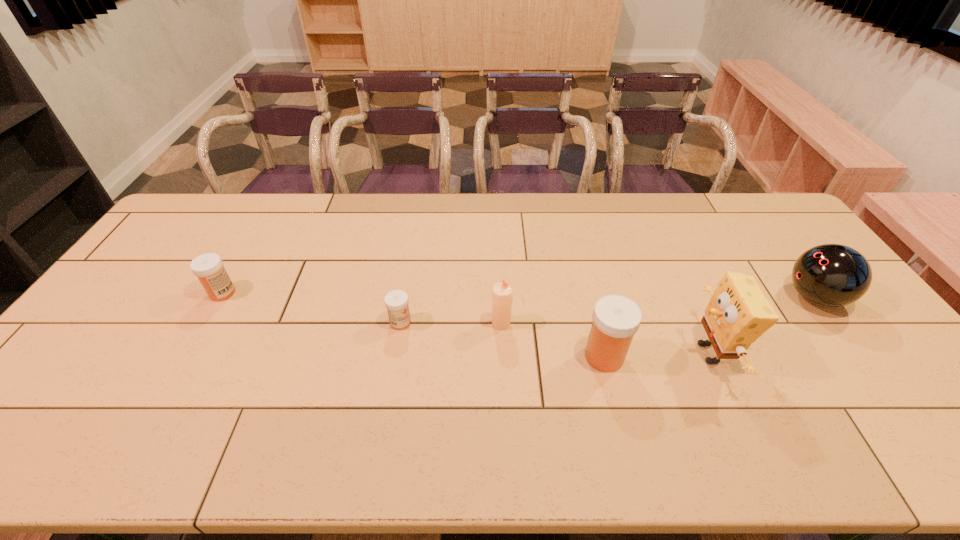
Where is `vacant space located on the right of the farthest medicine`? The image size is (960, 540). vacant space located on the right of the farthest medicine is located at coordinates (337, 293).

Locate an element on the screen. This screenshot has width=960, height=540. blank area located on the back of the second object from left to right is located at coordinates (414, 246).

Where is `vacant region located on the back of the fourth object from left to right`? The width and height of the screenshot is (960, 540). vacant region located on the back of the fourth object from left to right is located at coordinates (579, 252).

The width and height of the screenshot is (960, 540). In order to click on vacant area situated on the front of the candle in this screenshot , I will do `click(505, 407)`.

The height and width of the screenshot is (540, 960). In order to click on vacant space located on the surface of the rightmost object near the finger holes in this screenshot , I will do `click(679, 298)`.

Where is `vacant space located on the surface of the rightmost object near the finger holes`? Image resolution: width=960 pixels, height=540 pixels. vacant space located on the surface of the rightmost object near the finger holes is located at coordinates (712, 298).

You are a GUI agent. You are given a task and a screenshot of the screen. Output one action in this format:
    pyautogui.click(x=<x>, y=<y>)
    Task: Click on the vacant space situated 0.190m on the surface of the rightmost object near the finger holes
    This screenshot has height=540, width=960.
    Given the screenshot: What is the action you would take?
    pyautogui.click(x=719, y=298)

The image size is (960, 540). I want to click on vacant space located on the face of the sponge, so click(x=608, y=353).

You are a GUI agent. You are given a task and a screenshot of the screen. Output one action in this format:
    pyautogui.click(x=<x>, y=<y>)
    Task: Click on the free space located on the face of the sponge
    The image size is (960, 540).
    Given the screenshot: What is the action you would take?
    [565, 353]

Locate an element on the screen. The width and height of the screenshot is (960, 540). vacant space located 0.270m on the face of the sponge is located at coordinates (585, 353).